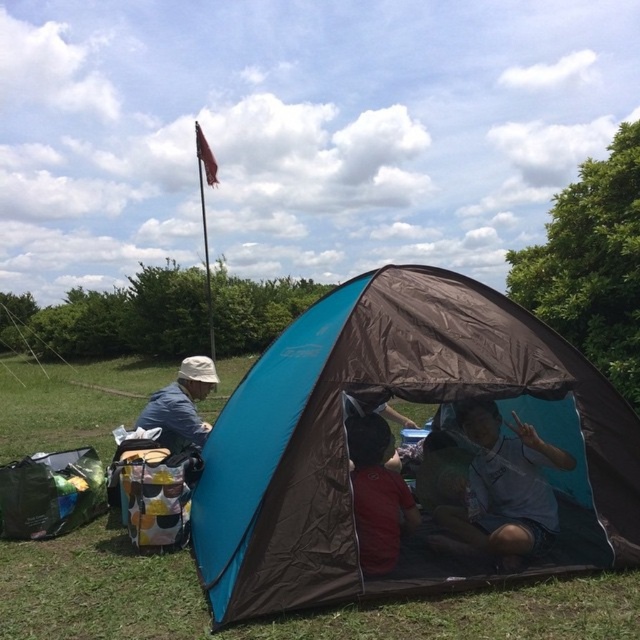
Between red matte shirt at center and matte blue shirt at left, which one appears on the right side from the viewer's perspective?

From the viewer's perspective, red matte shirt at center appears more on the right side.

Does red matte shirt at center appear under matte blue shirt at left?

Yes.

The height and width of the screenshot is (640, 640). Find the location of `red matte shirt at center`. red matte shirt at center is located at coordinates (376, 493).

The width and height of the screenshot is (640, 640). I want to click on red matte shirt at center, so click(x=376, y=493).

Can you confirm if matte blue tent at center is shorter than red matte shirt at center?

No.

Does matte blue tent at center come behind red matte shirt at center?

Yes.

Between point (502, 548) and point (374, 536), which one is positioned behind?

Point (502, 548)

Identify the location of matte blue tent at center. This screenshot has width=640, height=640. (500, 490).

Does matte blue tent at center appear on the left side of matte blue shirt at left?

No, matte blue tent at center is not to the left of matte blue shirt at left.

Which is more to the left, matte blue tent at center or matte blue shirt at left?

From the viewer's perspective, matte blue shirt at left appears more on the left side.

What do you see at coordinates (500, 490) in the screenshot? Image resolution: width=640 pixels, height=640 pixels. I see `matte blue tent at center` at bounding box center [500, 490].

The height and width of the screenshot is (640, 640). Find the location of `matte blue tent at center`. matte blue tent at center is located at coordinates (500, 490).